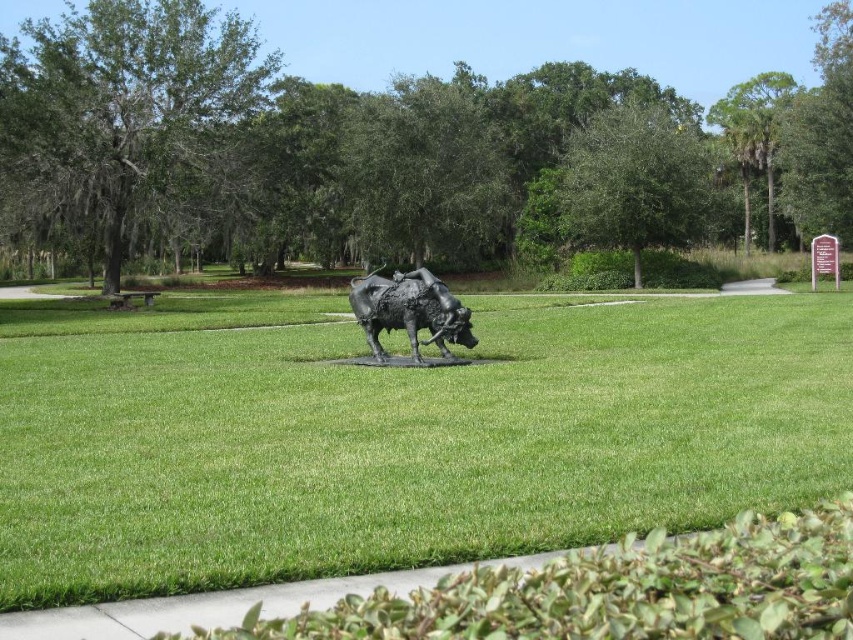
Which of these two, green grass at center or bronze statue at center, stands taller?

Standing taller between the two is bronze statue at center.

Measure the distance between point [172,413] and camera.

Point [172,413] and camera are 31.77 feet apart.

Locate an element on the screen. This screenshot has width=853, height=640. green grass at center is located at coordinates (405, 442).